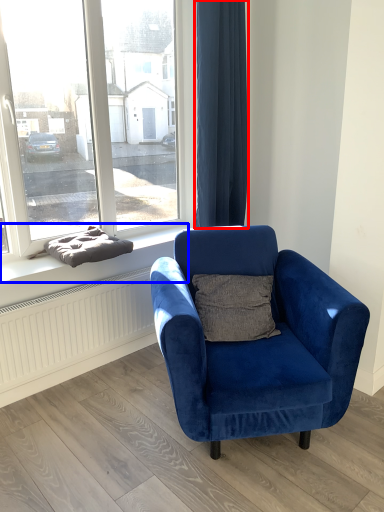
Question: Which of the following is the farthest to the observer, curtain (highlighted by a red box) or window sill (highlighted by a blue box)?

Choices:
 (A) curtain
 (B) window sill

Answer: (A)